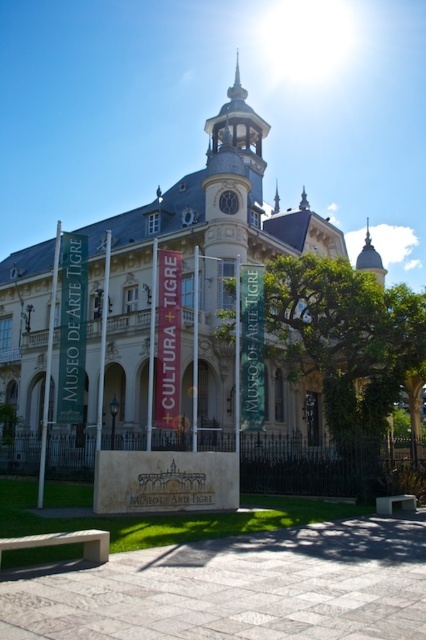
Question: Which object is closer to the camera taking this photo?

Choices:
 (A) wooden park bench at lower right
 (B) smooth concrete bench at lower left
 (C) light gray stone clock tower at upper center

Answer: (B)

Question: Which object is closer to the camera taking this photo?

Choices:
 (A) smooth concrete bench at lower left
 (B) light gray stone clock tower at upper center

Answer: (A)

Question: Can you confirm if smooth concrete bench at lower left is wider than wooden park bench at lower right?

Choices:
 (A) no
 (B) yes

Answer: (B)

Question: Can you confirm if light gray stone clock tower at upper center is positioned to the right of smooth concrete bench at lower left?

Choices:
 (A) yes
 (B) no

Answer: (A)

Question: Estimate the real-world distances between objects in this image. Which object is closer to the wooden park bench at lower right?

Choices:
 (A) smooth concrete bench at lower left
 (B) light gray stone clock tower at upper center

Answer: (A)

Question: Can you confirm if light gray stone clock tower at upper center is smaller than smooth concrete bench at lower left?

Choices:
 (A) yes
 (B) no

Answer: (B)